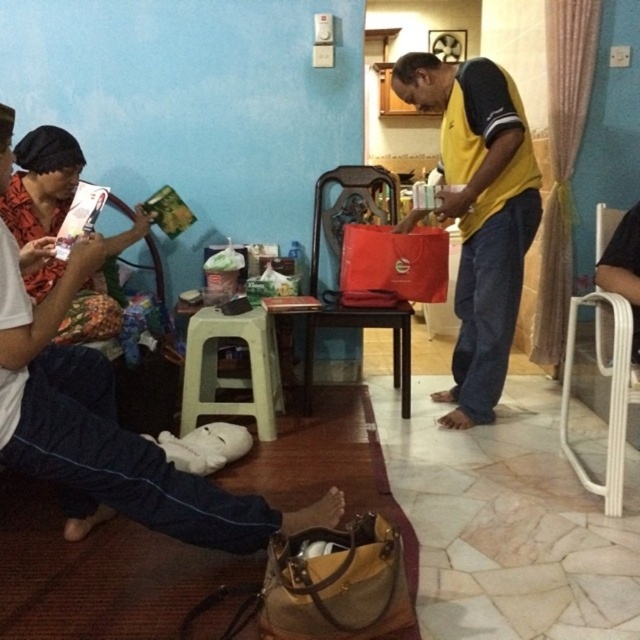
Question: Can you confirm if plastic stool at center is smaller than dark brown wooden chair at center?

Choices:
 (A) no
 (B) yes

Answer: (B)

Question: Does matte red shirt at left come behind dark brown wooden chair at center?

Choices:
 (A) no
 (B) yes

Answer: (A)

Question: Which point is closer to the camera?

Choices:
 (A) tap(48, 280)
 (B) tap(316, 204)
 (C) tap(237, 336)
 (D) tap(614, 419)

Answer: (D)

Question: Which object appears closest to the camera in this image?

Choices:
 (A) plastic stool at center
 (B) yellow jersey at center
 (C) dark brown wooden chair at center
 (D) matte red shirt at left

Answer: (D)

Question: Which point is farther to the camera?

Choices:
 (A) white plastic chair at lower right
 (B) plastic stool at center

Answer: (B)

Question: Where is yellow jersey at center located in relation to white plastic chair at lower right in the image?

Choices:
 (A) above
 (B) below

Answer: (A)